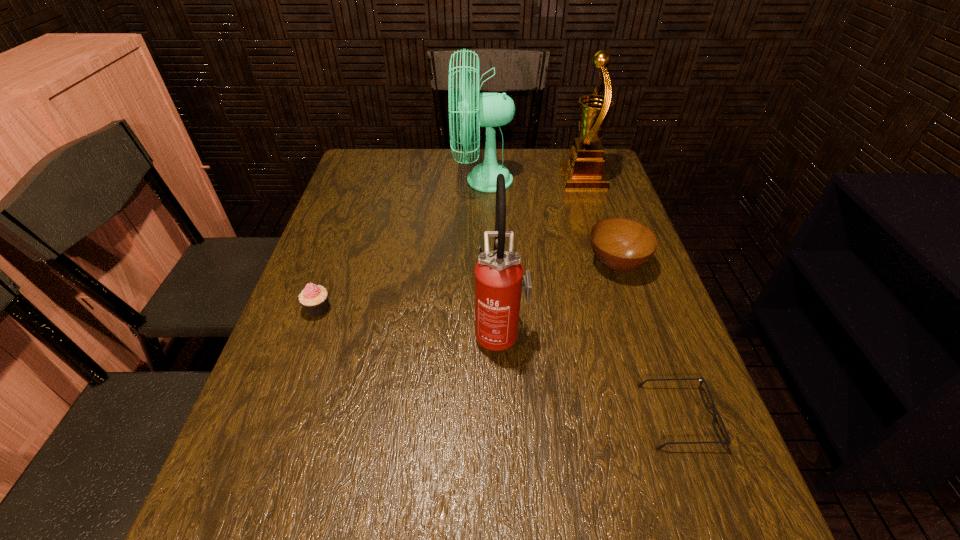
Locate an element on the screen. Image resolution: width=960 pixels, height=540 pixels. vacant point located between the fourth nearest object and the fan is located at coordinates (549, 222).

Where is `vacant point located between the award and the cupcake`? Image resolution: width=960 pixels, height=540 pixels. vacant point located between the award and the cupcake is located at coordinates (450, 244).

Identify the location of free area in between the fan and the bowl. (549, 222).

This screenshot has height=540, width=960. Find the location of `vacant space in between the shortest object and the leftmost object`. vacant space in between the shortest object and the leftmost object is located at coordinates (498, 363).

Where is `empty location between the award and the fan`? The width and height of the screenshot is (960, 540). empty location between the award and the fan is located at coordinates (533, 179).

Where is `free space between the fire extinguisher and the cupcake`? The height and width of the screenshot is (540, 960). free space between the fire extinguisher and the cupcake is located at coordinates (409, 321).

Choose which object is the fourth nearest neighbor to the fire extinguisher. Please provide its 2D coordinates. Your answer should be formatted as a tuple, i.e. [(x, y)], where the tuple contains the x and y coordinates of a point satisfying the conditions above.

[(493, 109)]

Find the location of `object that can be found as the third closest to the fire extinguisher`. object that can be found as the third closest to the fire extinguisher is located at coordinates (314, 299).

This screenshot has height=540, width=960. I want to click on free spot that satisfies the following two spatial constraints: 1. on the front-facing side of the award; 2. on the right side of the fourth nearest object, so click(x=610, y=264).

At what (x,y) coordinates should I click in order to perform the action: click on vacant area in the image that satisfies the following two spatial constraints: 1. on the front side of the bowl; 2. at the nozzle of the fire extinguisher. Please return your answer as a coordinate pair (x, y). This screenshot has width=960, height=540. Looking at the image, I should click on (638, 332).